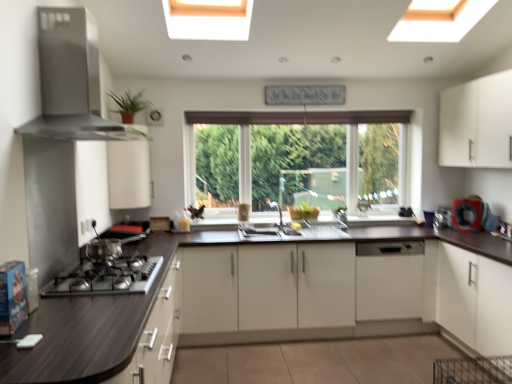
Describe the element at coordinates (279, 215) in the screenshot. Image resolution: width=512 pixels, height=384 pixels. I see `satin nickel faucet at center` at that location.

The width and height of the screenshot is (512, 384). In order to click on white matte cabinet at center, which is counted as the second cabinetry, starting from the left in this screenshot , I will do `click(298, 289)`.

Locate an element on the screen. green matte plant at upper left is located at coordinates (129, 102).

Can you tell me how much white matte cabinet at upper right, acting as the fourth cabinetry starting from the left, and stainless steel range hood at upper left differ in facing direction?

The angular difference between white matte cabinet at upper right, acting as the fourth cabinetry starting from the left, and stainless steel range hood at upper left is 179 degrees.

Is white matte cabinet at upper right, acting as the fourth cabinetry starting from the left, facing away from stainless steel range hood at upper left?

No, white matte cabinet at upper right, acting as the fourth cabinetry starting from the left, is not facing away from stainless steel range hood at upper left.

From a real-world perspective, does white matte cabinet at upper right, arranged as the first cabinetry when viewed from the right, stand above stainless steel range hood at upper left?

No, from a real-world perspective, white matte cabinet at upper right, arranged as the first cabinetry when viewed from the right, is not above stainless steel range hood at upper left.

Is white matte cabinet at upper right, arranged as the first cabinetry when viewed from the right, to the left of stainless steel range hood at upper left from the viewer's perspective?

No.

Would you consider white matte cabinet at upper right, arranged as the first cabinetry when viewed from the right, to be distant from white matte cabinet at upper center, the 1th cabinetry from the left?

Indeed, white matte cabinet at upper right, arranged as the first cabinetry when viewed from the right, is not near white matte cabinet at upper center, the 1th cabinetry from the left.

Locate an element on the screen. This screenshot has width=512, height=384. cabinetry that is the 3rd object to the left of the white matte cabinet at upper right, acting as the fourth cabinetry starting from the left, starting at the anchor is located at coordinates (128, 174).

Measure the distance between white matte cabinet at upper right, arranged as the first cabinetry when viewed from the right, and white matte cabinet at upper center, which is counted as the fourth cabinetry, starting from the right.

white matte cabinet at upper right, arranged as the first cabinetry when viewed from the right, and white matte cabinet at upper center, which is counted as the fourth cabinetry, starting from the right, are 9.36 feet apart.

From a real-world perspective, who is located lower, white matte cabinet at upper right, acting as the fourth cabinetry starting from the left, or white matte cabinet at upper center, which is counted as the fourth cabinetry, starting from the right?

In real-world perspective, white matte cabinet at upper center, which is counted as the fourth cabinetry, starting from the right, is lower.

Where is `countertop that is in front of the white matte cabinet at upper center, the 1th cabinetry from the left`? This screenshot has width=512, height=384. countertop that is in front of the white matte cabinet at upper center, the 1th cabinetry from the left is located at coordinates (86, 330).

Consider the image. Between dark wood countertop at lower left and white matte cabinet at upper center, the 1th cabinetry from the left, which one has larger width?

With larger width is dark wood countertop at lower left.

How many degrees apart are the facing directions of dark wood countertop at lower left and white matte cabinet at upper center, which is counted as the fourth cabinetry, starting from the right?

dark wood countertop at lower left and white matte cabinet at upper center, which is counted as the fourth cabinetry, starting from the right, are facing 39.5 degrees away from each other.

In the scene shown: Is the surface of white matte dishwasher at lower center, the third cabinetry from the left, in direct contact with black rubber ring at right?

No, white matte dishwasher at lower center, the third cabinetry from the left, is not next to black rubber ring at right.

Which of these two, white matte dishwasher at lower center, which is the 2th cabinetry in right-to-left order, or black rubber ring at right, is thinner?

Thinner between the two is black rubber ring at right.

From a real-world perspective, is white matte dishwasher at lower center, the third cabinetry from the left, positioned above or below black rubber ring at right?

In terms of real-world spatial position, white matte dishwasher at lower center, the third cabinetry from the left, is below black rubber ring at right.

Would you say white matte dishwasher at lower center, which is the 2th cabinetry in right-to-left order, contains black rubber ring at right?

No, black rubber ring at right is not surrounded by white matte dishwasher at lower center, which is the 2th cabinetry in right-to-left order.

From the image's perspective, would you say stainless steel range hood at upper left is shown under clear glass window at center?

Actually, stainless steel range hood at upper left appears above clear glass window at center in the image.

Is stainless steel range hood at upper left at the right side of clear glass window at center?

No, stainless steel range hood at upper left is not to the right of clear glass window at center.

Which of these two, stainless steel range hood at upper left or clear glass window at center, is thinner?

clear glass window at center.

Can you tell me how much stainless steel range hood at upper left and clear glass window at center differ in facing direction?

The angle between the facing direction of stainless steel range hood at upper left and the facing direction of clear glass window at center is 91.5 degrees.

Is point (298, 301) behind point (359, 115)?

No, (298, 301) is in front of (359, 115).

Which object is positioned more to the right, white matte cabinet at center, which is the 3th cabinetry in right-to-left order, or clear glass window at center?

Positioned to the right is white matte cabinet at center, which is the 3th cabinetry in right-to-left order.

Is white matte cabinet at center, which is the 3th cabinetry in right-to-left order, wider or thinner than clear glass window at center?

Considering their sizes, white matte cabinet at center, which is the 3th cabinetry in right-to-left order, looks broader than clear glass window at center.

Considering the positions of objects white matte cabinet at center, which is the 3th cabinetry in right-to-left order, and clear glass window at center in the image provided, who is behind, white matte cabinet at center, which is the 3th cabinetry in right-to-left order, or clear glass window at center?

clear glass window at center.

Which is in front, point (273, 205) or point (191, 163)?

The point (191, 163) is closer.

Considering the relative sizes of satin nickel faucet at center and clear glass window at center in the image provided, is satin nickel faucet at center wider than clear glass window at center?

Indeed, satin nickel faucet at center has a greater width compared to clear glass window at center.

How different are the orientations of satin nickel faucet at center and clear glass window at center in degrees?

The facing directions of satin nickel faucet at center and clear glass window at center are 1.93 degrees apart.

Identify the location of the 3rd cabinetry to the right when counting from the stainless steel range hood at upper left. (477, 123).

Locate an element on the screen. This screenshot has height=384, width=512. the 1st cabinetry below the white matte cabinet at upper right, acting as the fourth cabinetry starting from the left (from the image's perspective) is located at coordinates (128, 174).

Considering their positions, is white matte dishwasher at lower center, which is the 2th cabinetry in right-to-left order, positioned closer to white matte cabinet at center, which is counted as the second cabinetry, starting from the left, than dark wood countertop at lower left?

white matte dishwasher at lower center, which is the 2th cabinetry in right-to-left order, is positioned closer to the anchor white matte cabinet at center, which is counted as the second cabinetry, starting from the left.

Based on their spatial positions, is white glossy sink at center or white matte cabinet at center, which is the 3th cabinetry in right-to-left order, closer to black rubber ring at right?

white matte cabinet at center, which is the 3th cabinetry in right-to-left order, lies closer to black rubber ring at right than the other object.

Estimate the real-world distances between objects in this image. Which object is closer to satin nickel faucet at center, dark wood countertop at lower left or white matte cabinet at center, which is the 3th cabinetry in right-to-left order?

Among the two, white matte cabinet at center, which is the 3th cabinetry in right-to-left order, is located nearer to satin nickel faucet at center.

From the image, which object appears to be farther from satin nickel faucet at center, white glossy sink at center or white matte cabinet at upper right, acting as the fourth cabinetry starting from the left?

white matte cabinet at upper right, acting as the fourth cabinetry starting from the left.

Looking at the image, which one is located closer to green matte plant at upper left, stainless steel range hood at upper left or white matte cabinet at upper right, arranged as the first cabinetry when viewed from the right?

stainless steel range hood at upper left is positioned closer to the anchor green matte plant at upper left.

Looking at the image, which one is located closer to white matte dishwasher at lower center, which is the 2th cabinetry in right-to-left order, black rubber ring at right or clear glass window at center?

Among the two, black rubber ring at right is located nearer to white matte dishwasher at lower center, which is the 2th cabinetry in right-to-left order.

When comparing their distances from white matte dishwasher at lower center, which is the 2th cabinetry in right-to-left order, does dark wood countertop at lower left or black rubber ring at right seem further?

Based on the image, dark wood countertop at lower left appears to be further to white matte dishwasher at lower center, which is the 2th cabinetry in right-to-left order.

Looking at the image, which one is located closer to satin nickel faucet at center, white matte cabinet at center, which is the 3th cabinetry in right-to-left order, or stainless steel range hood at upper left?

white matte cabinet at center, which is the 3th cabinetry in right-to-left order.

Where is `plant between dark wood countertop at lower left and white matte dishwasher at lower center, which is the 2th cabinetry in right-to-left order, along the z-axis`? The height and width of the screenshot is (384, 512). plant between dark wood countertop at lower left and white matte dishwasher at lower center, which is the 2th cabinetry in right-to-left order, along the z-axis is located at coordinates coord(129,102).

Find the location of `window between green matte plant at upper left and white matte cabinet at upper right, acting as the fourth cabinetry starting from the left, in the horizontal direction`. window between green matte plant at upper left and white matte cabinet at upper right, acting as the fourth cabinetry starting from the left, in the horizontal direction is located at coordinates (297, 117).

At what (x,y) coordinates should I click in order to perform the action: click on faucet between white matte cabinet at upper center, which is counted as the fourth cabinetry, starting from the right, and white matte dishwasher at lower center, which is the 2th cabinetry in right-to-left order, in the horizontal direction. Please return your answer as a coordinate pair (x, y). Looking at the image, I should click on (279, 215).

Find the location of `plant between white matte cabinet at upper center, the 1th cabinetry from the left, and white matte cabinet at upper right, arranged as the first cabinetry when viewed from the right, from left to right`. plant between white matte cabinet at upper center, the 1th cabinetry from the left, and white matte cabinet at upper right, arranged as the first cabinetry when viewed from the right, from left to right is located at coordinates (129, 102).